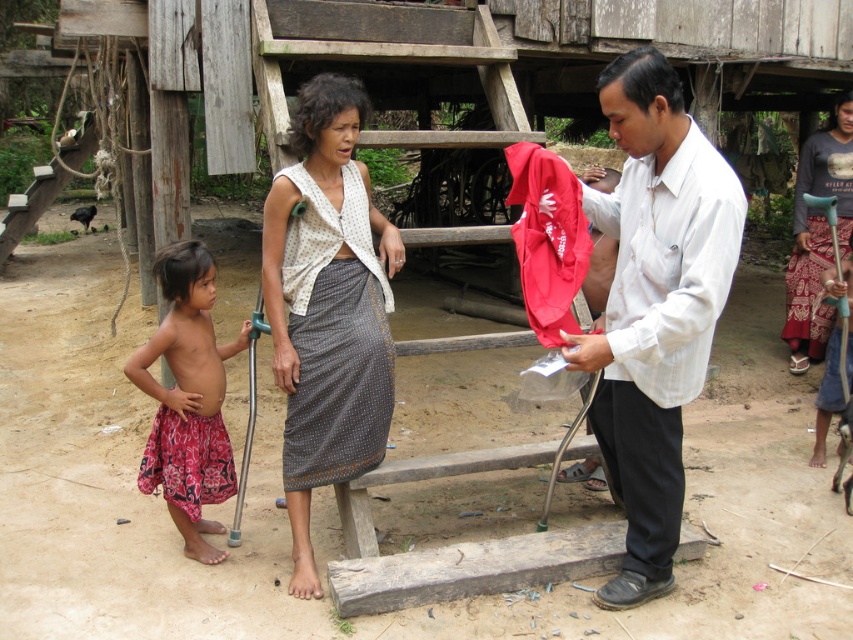
Does white linen shirt at center have a larger size compared to patterned fabric skirt at left?

Correct, white linen shirt at center is larger in size than patterned fabric skirt at left.

Between white linen shirt at center and patterned fabric skirt at left, which one appears on the left side from the viewer's perspective?

Positioned to the left is patterned fabric skirt at left.

Does point (693, 122) lie behind point (138, 355)?

No, it is in front of (138, 355).

Find the location of a particular element. This screenshot has width=853, height=640. white linen shirt at center is located at coordinates (654, 307).

Is point (234, 488) positioned after point (788, 321)?

No, it is in front of (788, 321).

Does patterned fabric skirt at left have a greater width compared to gray printed skirt at center?

Yes, patterned fabric skirt at left is wider than gray printed skirt at center.

Who is more distant from viewer, (x=206, y=385) or (x=802, y=356)?

Point (x=802, y=356)

The height and width of the screenshot is (640, 853). Identify the location of patterned fabric skirt at left. 187,400.

Between white linen shirt at center and gray dotted fabric skirt at center, which one appears on the right side from the viewer's perspective?

From the viewer's perspective, white linen shirt at center appears more on the right side.

Which of these two, white linen shirt at center or gray dotted fabric skirt at center, stands shorter?

gray dotted fabric skirt at center is shorter.

This screenshot has height=640, width=853. In order to click on white linen shirt at center in this screenshot , I will do `click(654, 307)`.

At what (x,y) coordinates should I click in order to perform the action: click on white linen shirt at center. Please return your answer as a coordinate pair (x, y). Image resolution: width=853 pixels, height=640 pixels. Looking at the image, I should click on (654, 307).